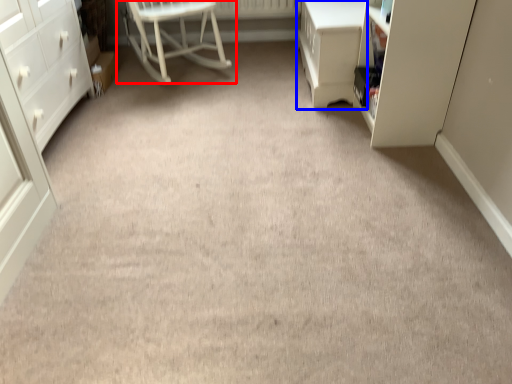
Question: Which object appears closest to the camera in this image, chair (highlighted by a red box) or vanity (highlighted by a blue box)?

Choices:
 (A) chair
 (B) vanity

Answer: (B)